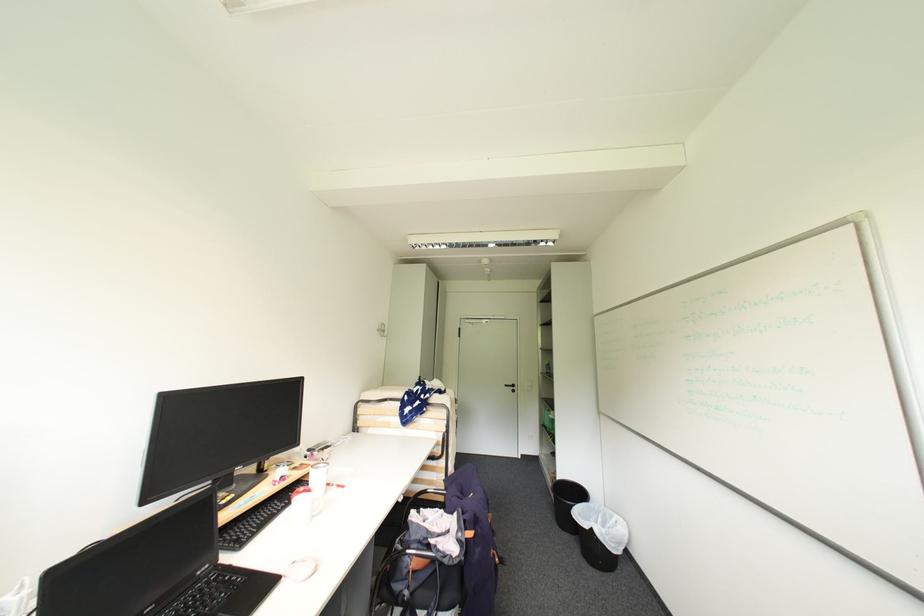
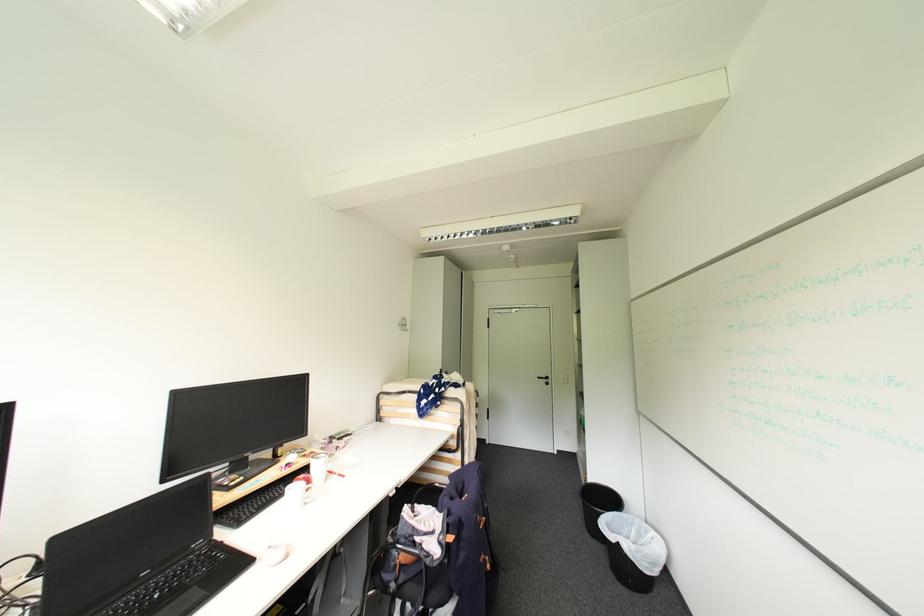
Where in the second image is the point corresponding to the point at 341,488 from the first image?

(343, 477)